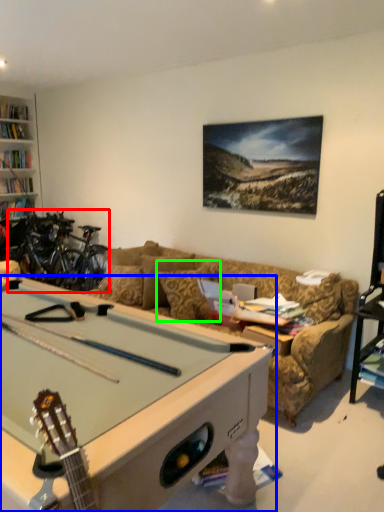
Question: Based on their relative distances, which object is nearer to bicycle (highlighted by a red box)? Choose from billiard table (highlighted by a blue box) and pillow (highlighted by a green box).

Choices:
 (A) billiard table
 (B) pillow

Answer: (B)